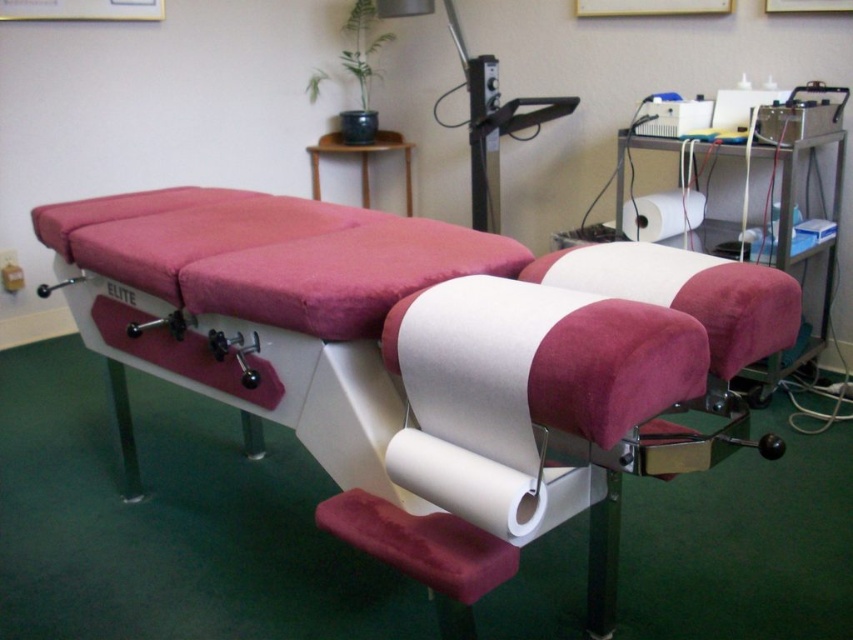
Between white matte toilet paper at lower center and white paper towel at center, which one has less height?

Standing shorter between the two is white matte toilet paper at lower center.

Is white matte toilet paper at lower center bigger than white paper towel at center?

Yes.

At what (x,y) coordinates should I click in order to perform the action: click on white matte toilet paper at lower center. Please return your answer as a coordinate pair (x, y). This screenshot has height=640, width=853. Looking at the image, I should click on (488, 484).

The image size is (853, 640). I want to click on white matte toilet paper at lower center, so click(488, 484).

Who is higher up, velvet-like pink hospital bed at center or velvet-like burgundy stool at lower center?

velvet-like pink hospital bed at center is higher up.

Can you confirm if velvet-like pink hospital bed at center is bigger than velvet-like burgundy stool at lower center?

Yes.

Find the location of a particular element. velvet-like pink hospital bed at center is located at coordinates pyautogui.click(x=418, y=365).

Is velvet-like pink hospital bed at center further to camera compared to white paper towel at center?

That is False.

At what (x,y) coordinates should I click in order to perform the action: click on velvet-like pink hospital bed at center. Please return your answer as a coordinate pair (x, y). The width and height of the screenshot is (853, 640). Looking at the image, I should click on (418, 365).

What do you see at coordinates (418, 365) in the screenshot? Image resolution: width=853 pixels, height=640 pixels. I see `velvet-like pink hospital bed at center` at bounding box center [418, 365].

I want to click on velvet-like pink hospital bed at center, so click(x=418, y=365).